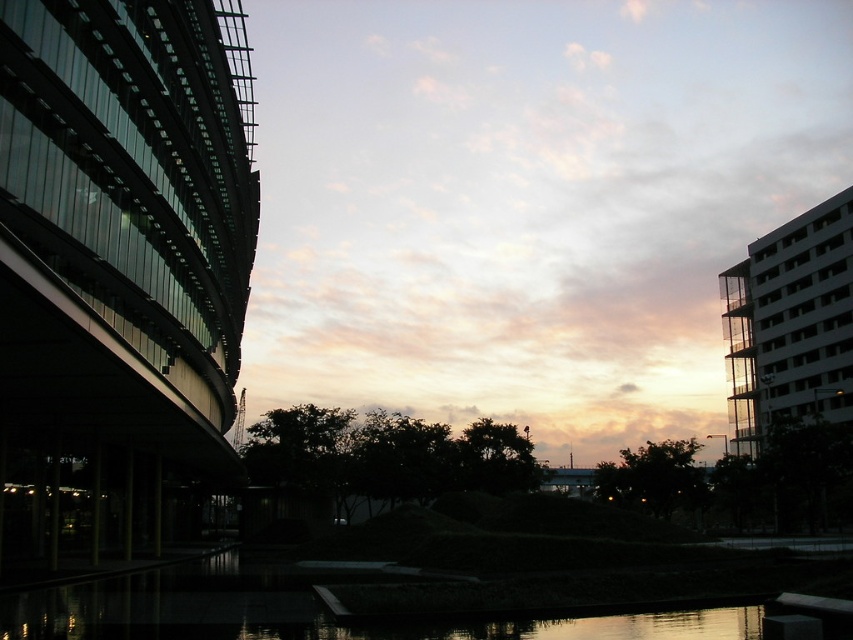
Who is more forward, [257,397] or [84,625]?

Point [84,625]

Looking at this image, between pastel sky at center and black reflective water at center, which one is positioned lower?

black reflective water at center

Does point (583, 394) come closer to viewer compared to point (189, 589)?

No, (583, 394) is behind (189, 589).

This screenshot has width=853, height=640. I want to click on pastel sky at center, so click(x=527, y=202).